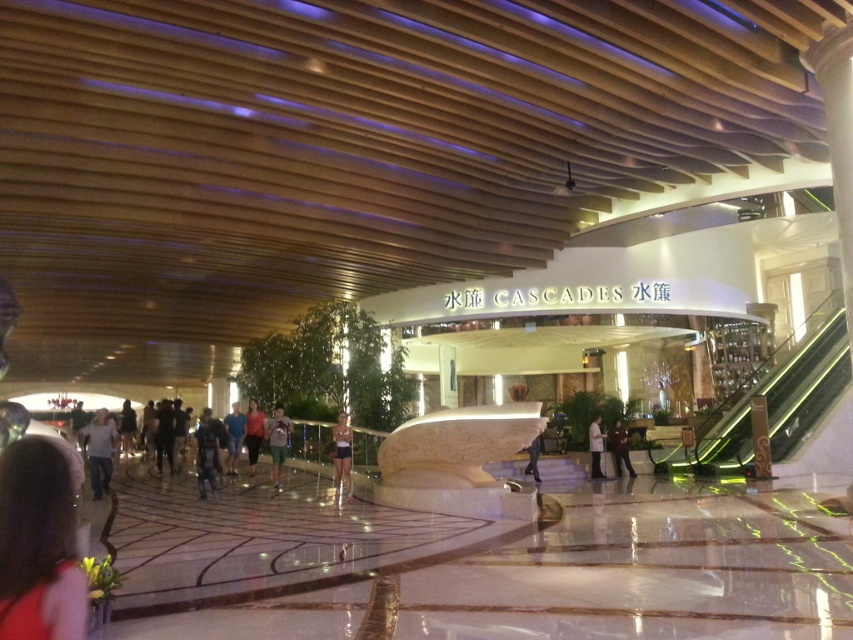
Question: Is light blue jeans at center positioned in front of matte gray shirt at center?

Choices:
 (A) yes
 (B) no

Answer: (A)

Question: Which point is farther from the camera taking this photo?

Choices:
 (A) (273, 424)
 (B) (624, 435)
 (C) (12, 500)
 (D) (527, 472)

Answer: (B)

Question: Considering the real-world distances, which object is closest to the green fabric shorts at center?

Choices:
 (A) matte gray shirt at center
 (B) light brown leather jacket at center

Answer: (A)

Question: Can you confirm if red fabric dress at lower left is thinner than dark brown leather jacket at center?

Choices:
 (A) yes
 (B) no

Answer: (A)

Question: Is red fabric dress at lower left smaller than dark blue fabric jacket at center?

Choices:
 (A) yes
 (B) no

Answer: (A)

Question: Which point is farther from the camera taking this photo?

Choices:
 (A) (71, 492)
 (B) (230, 458)

Answer: (B)